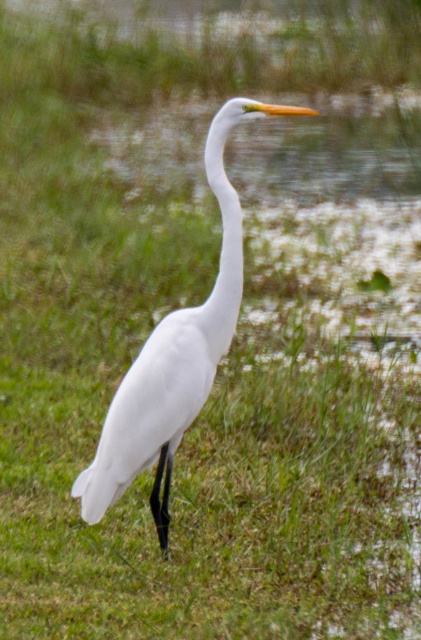
Consider the image. Does white matte bird at center have a greater width compared to white smooth neck at center?

Indeed, white matte bird at center has a greater width compared to white smooth neck at center.

Is point (210, 129) closer to camera compared to point (220, 330)?

No, it is not.

What do you see at coordinates (175, 355) in the screenshot? I see `white matte bird at center` at bounding box center [175, 355].

In order to click on white matte bird at center in this screenshot , I will do `click(175, 355)`.